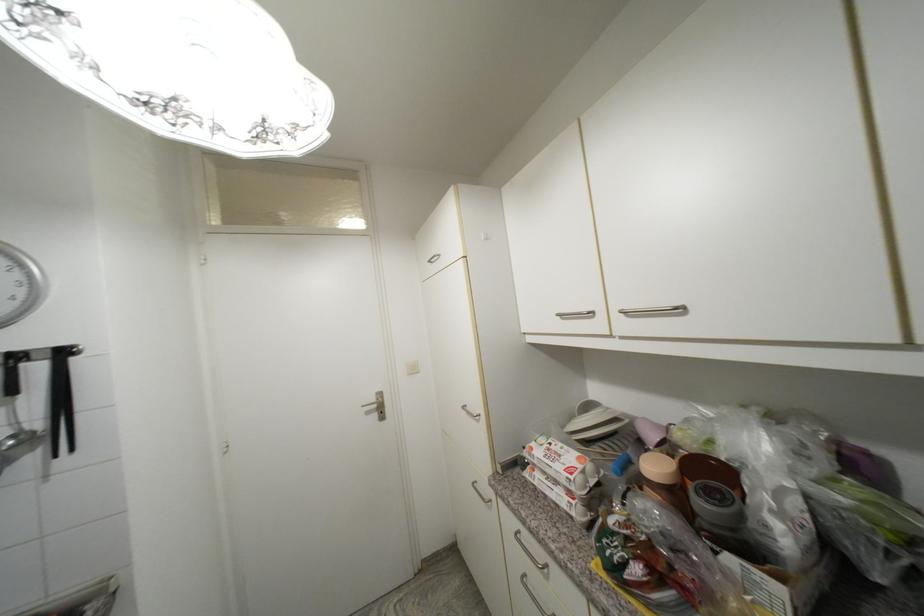
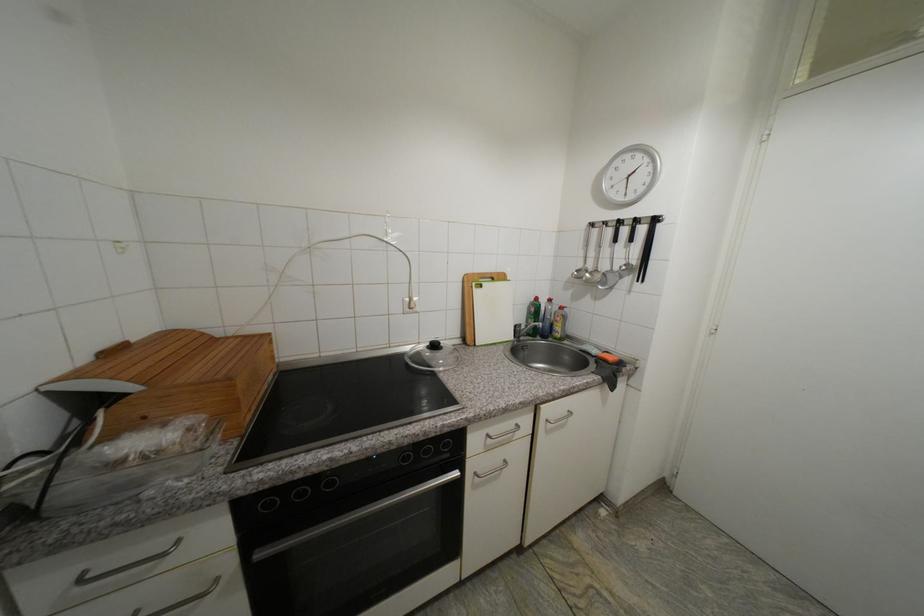
Based on the continuous images, in which direction is the camera rotating?

The camera rotated toward left-down.